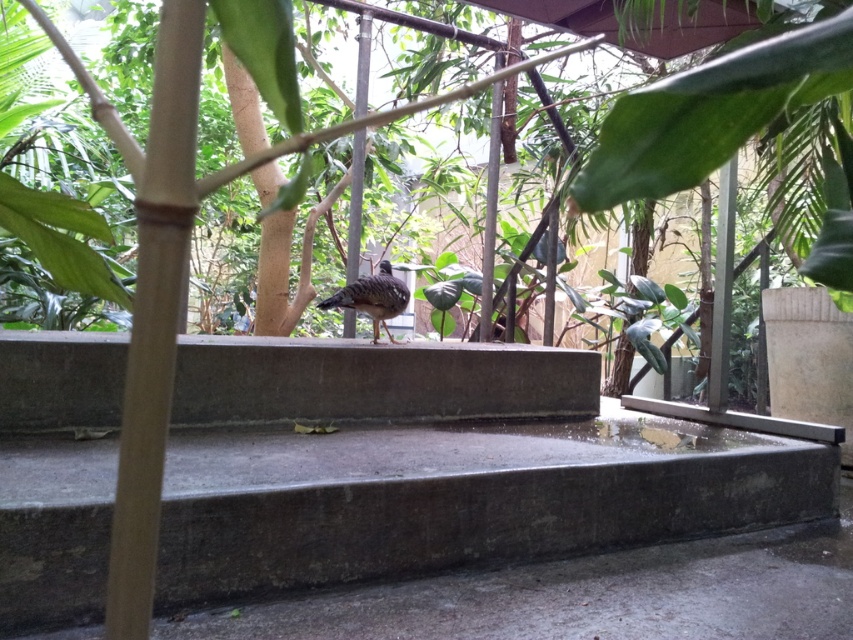
Looking at this image, who is positioned more to the left, concrete stairs at center or speckled feathered bird at center?

Positioned to the left is speckled feathered bird at center.

Between concrete stairs at center and speckled feathered bird at center, which one appears on the right side from the viewer's perspective?

From the viewer's perspective, concrete stairs at center appears more on the right side.

This screenshot has height=640, width=853. In order to click on concrete stairs at center in this screenshot , I will do `click(438, 467)`.